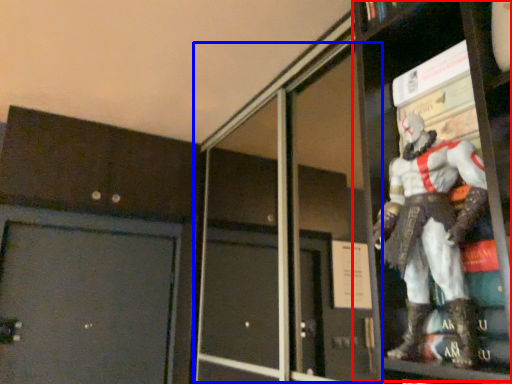
Question: Which of the following is the closest to the observer, shelf (highlighted by a red box) or screen door (highlighted by a blue box)?

Choices:
 (A) shelf
 (B) screen door

Answer: (A)